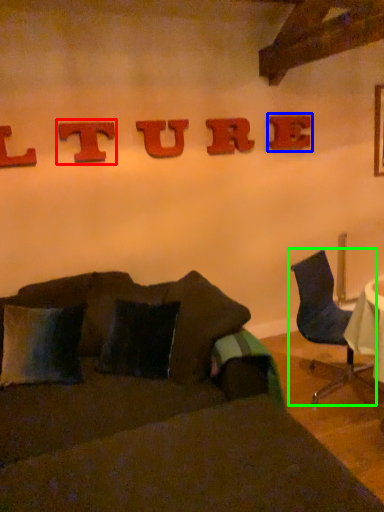
Question: Which object is positioned closest to alphabet (highlighted by a red box)? Select from alphabet (highlighted by a blue box) and chair (highlighted by a green box).

Choices:
 (A) alphabet
 (B) chair

Answer: (A)